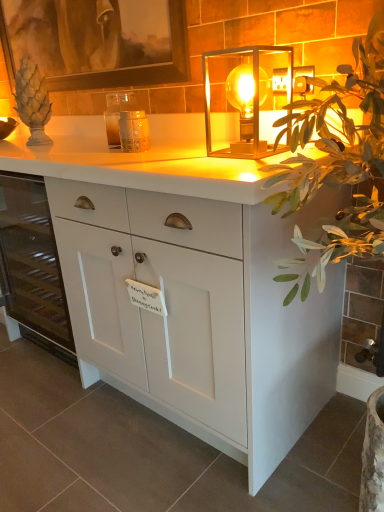
Question: Would you say white matte cabinet at left is part of white matte cabinet at center's contents?

Choices:
 (A) yes
 (B) no

Answer: (B)

Question: Would you say white matte cabinet at center is a long distance from white matte cabinet at left?

Choices:
 (A) no
 (B) yes

Answer: (A)

Question: Does white matte cabinet at center lie behind white matte cabinet at left?

Choices:
 (A) yes
 (B) no

Answer: (B)

Question: Does white matte cabinet at center appear on the right side of white matte cabinet at left?

Choices:
 (A) no
 (B) yes

Answer: (B)

Question: Is white matte cabinet at center to the left of white matte cabinet at left from the viewer's perspective?

Choices:
 (A) yes
 (B) no

Answer: (B)

Question: Is point (28, 12) positioned closer to the camera than point (327, 389)?

Choices:
 (A) closer
 (B) farther

Answer: (B)

Question: Is wooden picture frame at upper left taller or shorter than white matte cabinet at center?

Choices:
 (A) tall
 (B) short

Answer: (B)

Question: From the image's perspective, is wooden picture frame at upper left positioned above or below white matte cabinet at center?

Choices:
 (A) below
 (B) above

Answer: (B)

Question: Is wooden picture frame at upper left spatially inside white matte cabinet at center, or outside of it?

Choices:
 (A) inside
 (B) outside

Answer: (B)

Question: Looking at the image, does white matte cabinet at left seem bigger or smaller compared to white matte cabinet at center?

Choices:
 (A) small
 (B) big

Answer: (B)

Question: From a real-world perspective, is white matte cabinet at left physically located above or below white matte cabinet at center?

Choices:
 (A) below
 (B) above

Answer: (A)

Question: In the image, is white matte cabinet at left positioned in front of or behind white matte cabinet at center?

Choices:
 (A) front
 (B) behind

Answer: (B)

Question: Is white matte cabinet at left wider or thinner than white matte cabinet at center?

Choices:
 (A) thin
 (B) wide

Answer: (A)

Question: Would you say translucent glass candle holder at center is inside or outside translucent glass cube at center?

Choices:
 (A) inside
 (B) outside

Answer: (B)

Question: From the image's perspective, is translucent glass candle holder at center above or below translucent glass cube at center?

Choices:
 (A) below
 (B) above

Answer: (B)